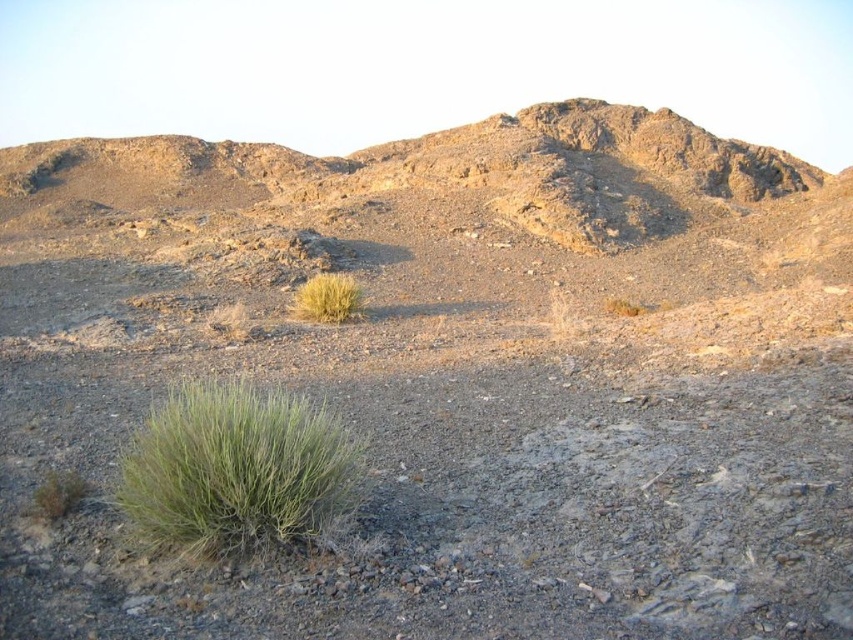
You are standing at the origin point of the coordinate system in this arid landscape. You want to find the green leafy bush at lower left. According to the coordinates provided, where should you look relative to your current position?

The green leafy bush at lower left is located at coordinates point 0.734 on the x axis and 0.278 on the y axis, so you should move towards the lower left direction from your current position to find it.

In the scene shown: You are navigating a desert terrain and need to locate the green leafy bush at lower left. According to the coordinates provided, where exactly is this bush positioned?

The green leafy bush at lower left is exactly at point (236, 468).